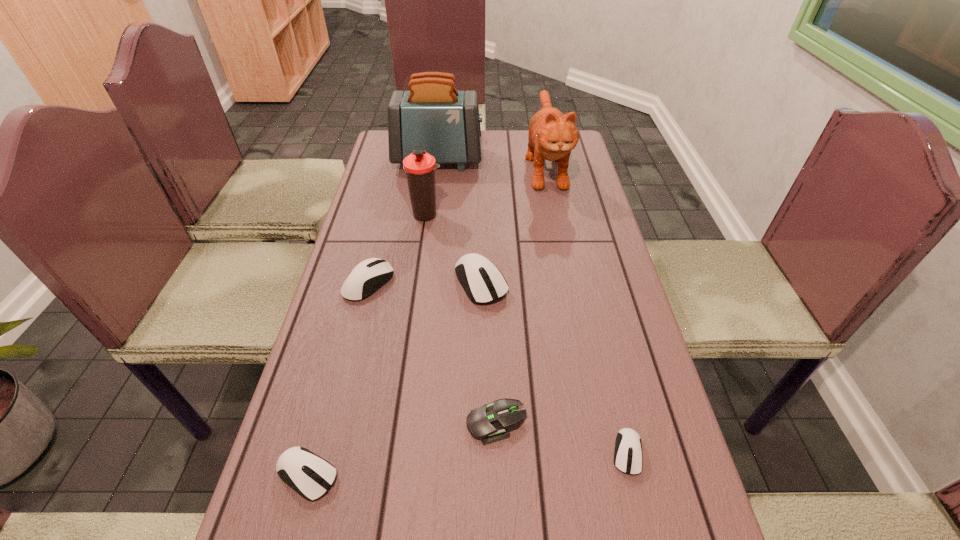
You are a GUI agent. You are given a task and a screenshot of the screen. Output one action in this format:
    pyautogui.click(x=<x>, y=<y>)
    Task: Click on the vacant space located on the right of the gray computer mouse
    This screenshot has width=960, height=540.
    Given the screenshot: What is the action you would take?
    pyautogui.click(x=558, y=423)

At what (x,y) coordinates should I click in order to perform the action: click on toaster positioned at the far edge. Please return your answer as a coordinate pair (x, y). The image size is (960, 540). Looking at the image, I should click on (432, 113).

At what (x,y) coordinates should I click in order to perform the action: click on cat that is positioned at the far edge. Please return your answer as a coordinate pair (x, y). Image resolution: width=960 pixels, height=540 pixels. Looking at the image, I should click on (552, 135).

Find the location of `toaster present at the left edge`. toaster present at the left edge is located at coordinates (432, 113).

Locate an element on the screen. This screenshot has width=960, height=540. thermos bottle at the left edge is located at coordinates (419, 166).

What are the coordinates of `cat present at the right edge` in the screenshot? It's located at (552, 135).

Locate an element on the screen. The height and width of the screenshot is (540, 960). mouse located in the right edge section of the desktop is located at coordinates (628, 458).

The image size is (960, 540). Identify the location of object situated at the far left corner. (432, 113).

Identify the location of object positioned at the far right corner. (552, 135).

Where is `free space at the left edge of the desktop`? free space at the left edge of the desktop is located at coordinates (351, 481).